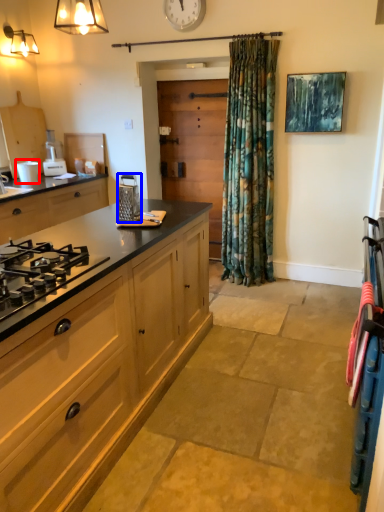
Question: Which point is further to the camera, appliance (highlighted by a red box) or kitchen appliance (highlighted by a blue box)?

Choices:
 (A) appliance
 (B) kitchen appliance

Answer: (A)